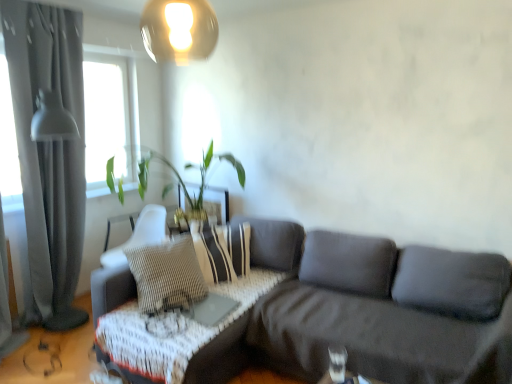
What are the coordinates of `wooden textured table at lower center, acting as the 2th table starting from the back` in the screenshot? It's located at (353, 377).

The height and width of the screenshot is (384, 512). Find the location of `matte black table lamp at lower right`. matte black table lamp at lower right is located at coordinates (337, 363).

What do you see at coordinates (176, 335) in the screenshot? I see `woven fabric table at center, the 1th table from the left` at bounding box center [176, 335].

The image size is (512, 384). Describe the element at coordinates (183, 181) in the screenshot. I see `green leafy plant at upper left` at that location.

Image resolution: width=512 pixels, height=384 pixels. Describe the element at coordinates (361, 307) in the screenshot. I see `dark gray fabric couch at center` at that location.

You are a GUI agent. You are given a task and a screenshot of the screen. Output one action in this format:
    pyautogui.click(x=<x>, y=<y>)
    Task: Click on the gray fabric curtain at left
    
    Given the screenshot: What is the action you would take?
    pyautogui.click(x=49, y=149)

Can you confirm if matte black table lamp at lower right is thinner than woven fabric armchair at center?

Correct, the width of matte black table lamp at lower right is less than that of woven fabric armchair at center.

Does matte black table lamp at lower right touch woven fabric armchair at center?

matte black table lamp at lower right is not next to woven fabric armchair at center, and they're not touching.

From a real-world perspective, which is physically below, matte black table lamp at lower right or woven fabric armchair at center?

matte black table lamp at lower right is physically lower.

Considering the relative sizes of matte black table lamp at lower right and woven fabric armchair at center in the image provided, is matte black table lamp at lower right shorter than woven fabric armchair at center?

Correct, matte black table lamp at lower right is not as tall as woven fabric armchair at center.

From a real-world perspective, is wooden textured table at lower center, the second table in the left-to-right sequence, below gold metallic lampshade at upper center?

Correct, in the physical world, wooden textured table at lower center, the second table in the left-to-right sequence, is lower than gold metallic lampshade at upper center.

Does wooden textured table at lower center, which ranks as the 1th table in right-to-left order, turn towards gold metallic lampshade at upper center?

No, wooden textured table at lower center, which ranks as the 1th table in right-to-left order, is not aimed at gold metallic lampshade at upper center.

Do you think wooden textured table at lower center, which is counted as the first table, starting from the front, is within gold metallic lampshade at upper center, or outside of it?

wooden textured table at lower center, which is counted as the first table, starting from the front, is not enclosed by gold metallic lampshade at upper center.

From the image's perspective, is wooden textured table at lower center, the second table in the left-to-right sequence, located above or below gold metallic lampshade at upper center?

Based on their image positions, wooden textured table at lower center, the second table in the left-to-right sequence, is located beneath gold metallic lampshade at upper center.

In the scene shown: Which of these two, green leafy plant at upper left or woven fabric armchair at center, stands taller?

green leafy plant at upper left is taller.

Can you confirm if green leafy plant at upper left is smaller than woven fabric armchair at center?

Incorrect, green leafy plant at upper left is not smaller in size than woven fabric armchair at center.

Is green leafy plant at upper left inside the boundaries of woven fabric armchair at center, or outside?

green leafy plant at upper left cannot be found inside woven fabric armchair at center.

Considering the sizes of objects green leafy plant at upper left and woven fabric armchair at center in the image provided, who is wider, green leafy plant at upper left or woven fabric armchair at center?

green leafy plant at upper left is wider.

Is matte black table lamp at lower right at the back of wooden textured table at lower center, which ranks as the 1th table in right-to-left order?

No, matte black table lamp at lower right is not at the back of wooden textured table at lower center, which ranks as the 1th table in right-to-left order.

Does wooden textured table at lower center, the second table in the left-to-right sequence, lie behind matte black table lamp at lower right?

No, it is in front of matte black table lamp at lower right.

Which point is more distant from viewer, (322, 376) or (338, 348)?

Point (322, 376)

Based on the photo, how different are the orientations of wooden textured table at lower center, acting as the 2th table starting from the back, and matte black table lamp at lower right in degrees?

wooden textured table at lower center, acting as the 2th table starting from the back, and matte black table lamp at lower right are facing 1.73 degrees away from each other.

In the scene shown: Is gold metallic lampshade at upper center not close to wooden textured table at lower center, the second table in the left-to-right sequence?

Indeed, gold metallic lampshade at upper center is not near wooden textured table at lower center, the second table in the left-to-right sequence.

Looking at this image, considering the relative positions of gold metallic lampshade at upper center and wooden textured table at lower center, which ranks as the 1th table in right-to-left order, in the image provided, is gold metallic lampshade at upper center to the right of wooden textured table at lower center, which ranks as the 1th table in right-to-left order, from the viewer's perspective?

No, gold metallic lampshade at upper center is not to the right of wooden textured table at lower center, which ranks as the 1th table in right-to-left order.

Locate an element on the screen. The width and height of the screenshot is (512, 384). table that is the 1st object located behind the gold metallic lampshade at upper center is located at coordinates (353, 377).

Which is closer, (223,254) or (199,191)?

The point (223,254) is closer to the camera.

Is striped fabric pillow at center wider than green leafy plant at upper left?

No, striped fabric pillow at center is not wider than green leafy plant at upper left.

From a real-world perspective, which is physically below, striped fabric pillow at center or green leafy plant at upper left?

striped fabric pillow at center, from a real-world perspective.

Does striped fabric pillow at center contain green leafy plant at upper left?

No, green leafy plant at upper left is located outside of striped fabric pillow at center.

From a real-world perspective, which is physically above, dark gray fabric couch at center or gold metallic lampshade at upper center?

From a 3D spatial view, gold metallic lampshade at upper center is above.

Is dark gray fabric couch at center in contact with gold metallic lampshade at upper center?

No.

Where is `studio couch in front of the gold metallic lampshade at upper center`? Image resolution: width=512 pixels, height=384 pixels. studio couch in front of the gold metallic lampshade at upper center is located at coordinates pyautogui.click(x=361, y=307).

Is point (452, 295) behind point (166, 58)?

No.

I want to click on armchair that is above the matte black table lamp at lower right (from a real-world perspective), so click(x=139, y=235).

The image size is (512, 384). I want to click on table that is the 1st object directly below the gold metallic lampshade at upper center (from a real-world perspective), so click(x=353, y=377).

Considering their positions, is matte black table lamp at lower right positioned further to woven fabric table at center, the 2th table from the front, than dark gray fabric couch at center?

Among the two, matte black table lamp at lower right is located further to woven fabric table at center, the 2th table from the front.

When comparing their distances from striped fabric pillow at center, does woven fabric armchair at center or dark gray fabric couch at center seem further?

woven fabric armchair at center lies further to striped fabric pillow at center than the other object.

From the image, which object appears to be farther from gray fabric curtain at left, matte black table lamp at lower right or woven fabric armchair at center?

matte black table lamp at lower right is further to gray fabric curtain at left.

Which object lies further to the anchor point woven fabric armchair at center, wooden textured table at lower center, which is counted as the first table, starting from the front, or striped fabric pillow at center?

Among the two, wooden textured table at lower center, which is counted as the first table, starting from the front, is located further to woven fabric armchair at center.

From the image, which object appears to be nearer to gold metallic lampshade at upper center, wooden textured table at lower center, acting as the 2th table starting from the back, or woven fabric armchair at center?

woven fabric armchair at center.

Which object lies further to the anchor point woven fabric table at center, marked as the second table in a right-to-left arrangement, gold metallic lampshade at upper center or striped fabric pillow at center?

gold metallic lampshade at upper center lies further to woven fabric table at center, marked as the second table in a right-to-left arrangement, than the other object.

Which object lies further to the anchor point gray fabric curtain at left, woven fabric armchair at center or matte black table lamp at lower right?

Among the two, matte black table lamp at lower right is located further to gray fabric curtain at left.

Based on their spatial positions, is wooden textured table at lower center, which ranks as the 1th table in right-to-left order, or striped fabric pillow at center further from dark gray fabric couch at center?

Among the two, striped fabric pillow at center is located further to dark gray fabric couch at center.

At what (x,y) coordinates should I click in order to perform the action: click on studio couch situated between woven fabric table at center, the 2th table from the front, and wooden textured table at lower center, which ranks as the 1th table in right-to-left order, from left to right. Please return your answer as a coordinate pair (x, y). The width and height of the screenshot is (512, 384). Looking at the image, I should click on (361, 307).

Find the location of a particular element. The height and width of the screenshot is (384, 512). lamp positioned between dark gray fabric couch at center and striped fabric pillow at center from near to far is located at coordinates (179, 30).

I want to click on table between dark gray fabric couch at center and matte black table lamp at lower right from front to back, so pos(353,377).

Where is `plant located between gray fabric curtain at left and matte black table lamp at lower right in the left-right direction`? plant located between gray fabric curtain at left and matte black table lamp at lower right in the left-right direction is located at coordinates [183, 181].